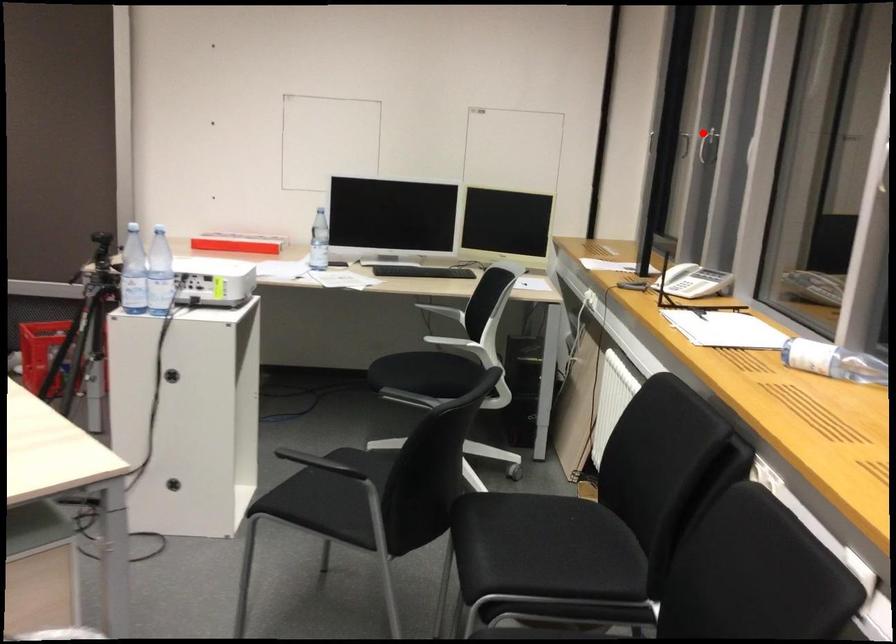
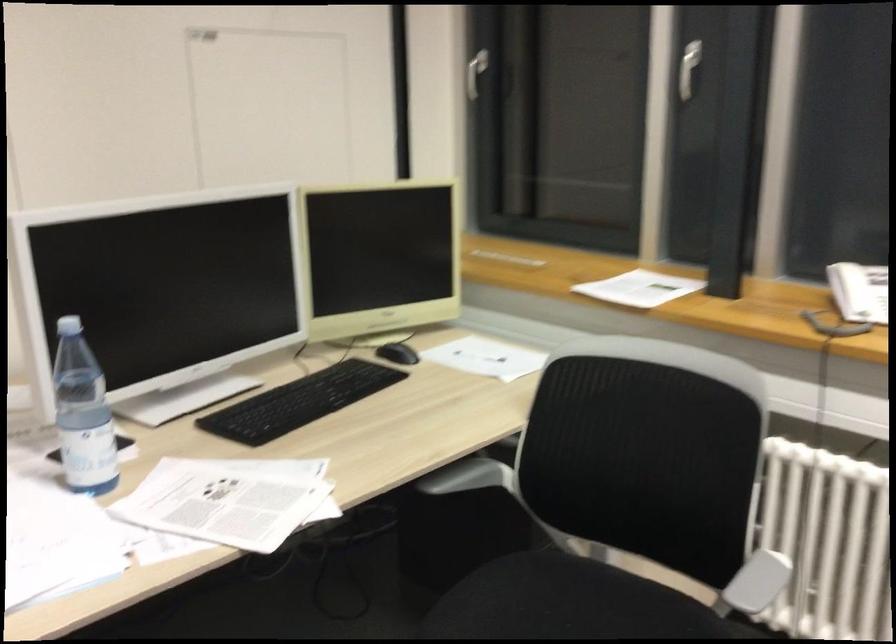
Find the pixel in the second image that matches the highlighted location in the first image.

(688, 69)